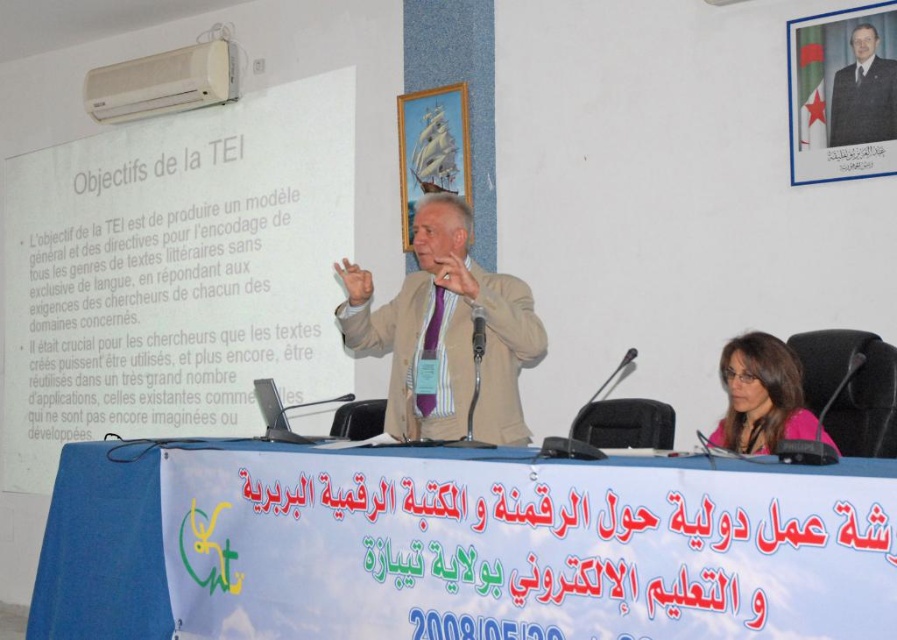
From the picture: You are an event organizer and need to ensure that the blue fabric banner at lower center is visible to the audience behind the beige fabric suit at center. Based on their heights, will the banner be visible?

The blue fabric banner at lower center is not as tall as the beige fabric suit at center, so it will be partially or fully obscured by the suit, making it less visible to the audience.

You are an attendee at the presentation. You notice the white paper at upper center and the beige fabric suit at center. Which object is located higher in the image?

The white paper at upper center is located higher in the image than the beige fabric suit at center.

You are organizing an event and need to place a decorative item on the table. The table is covered with a blue cloth. Where is the blue fabric banner at lower center positioned relative to the table?

The blue fabric banner at lower center is located at point (454, 544) on the table, so it is positioned at that coordinate relative to the table.